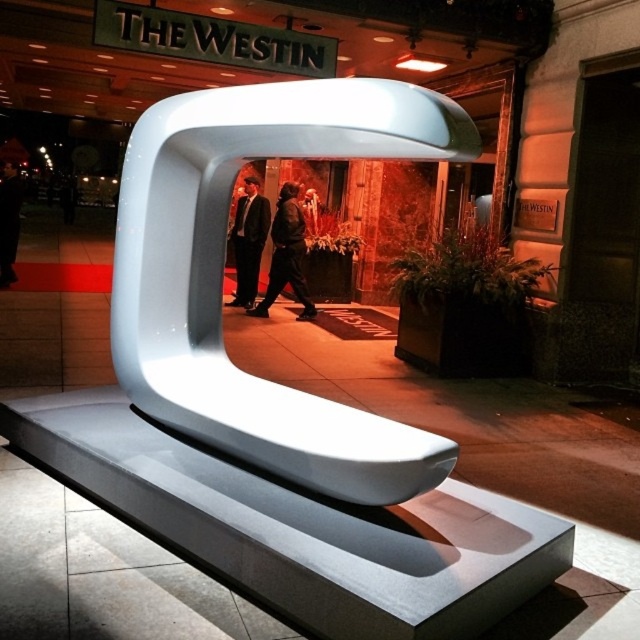
You are standing in front of the sculpture at The Westin hotel entrance. You see a dark brown leather jacket at center and a dark suit at center. Which one is shorter?

The dark brown leather jacket at center is shorter than the dark suit at center.

You are a guest at The Westin hotel and want to sit on the white glossy bench at center. However, you are carrying a dark brown leather jacket at center. Since you don not want to leave your jacket on the ground, where should you place it?

The white glossy bench at center is taller than the dark brown leather jacket at center, so you can place the dark brown leather jacket at center on the bench to keep it off the ground.